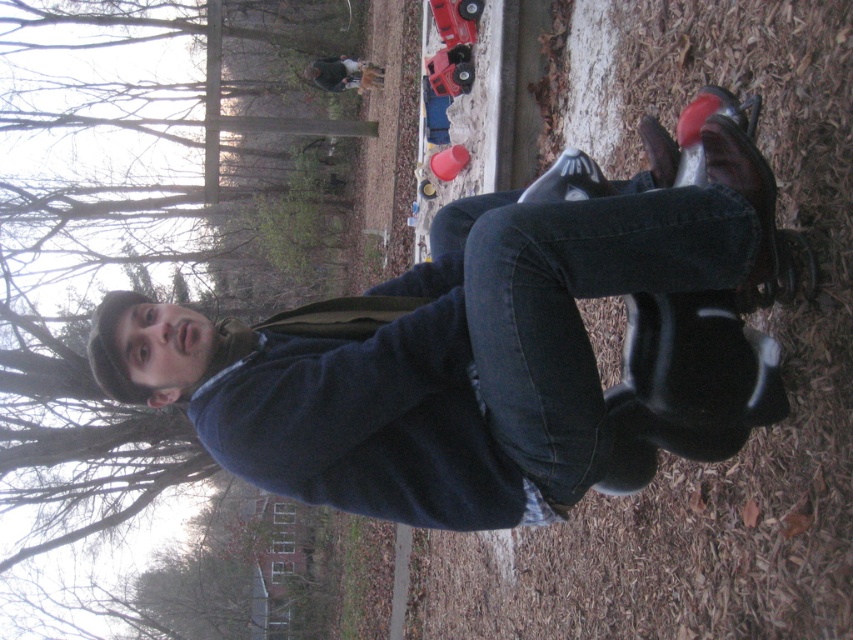
You are a photographer trying to capture a detailed shot of both the black leather shoe at lower right and the matte black shoe at center. Since the image is rotated, you need to adjust your camera angle. Which shoe should you focus on first to ensure it appears larger in the photo?

The black leather shoe at lower right is closer to the viewer than the matte black shoe at center, so focusing on it first will make it appear larger in the photo due to its proximity.

You are a delivery person trying to place a small package between the matte black skateboard at center and the denim at center. Can you fit it there?

The distance between the matte black skateboard at center and the denim at center is 12.41 inches, so yes, the package can fit there if it is smaller than that width.